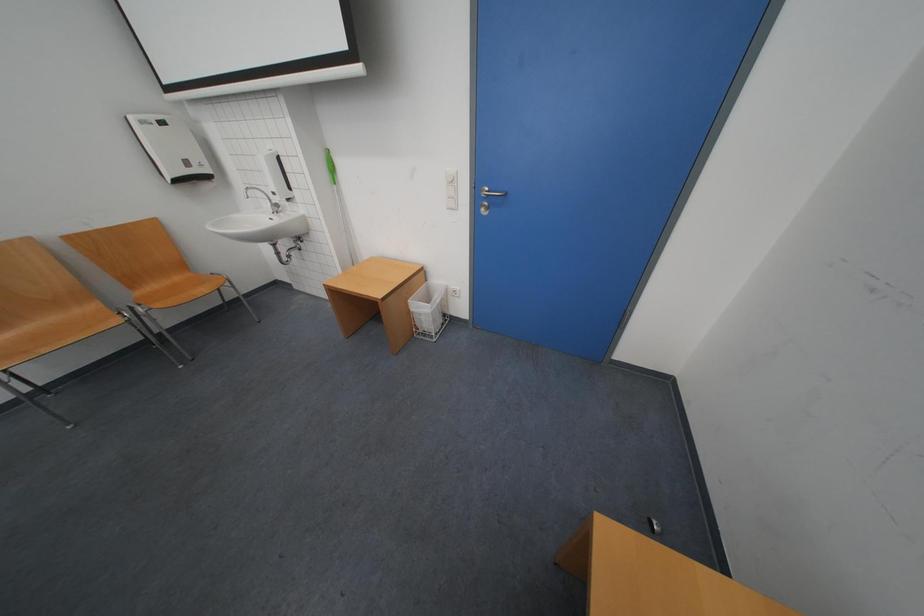
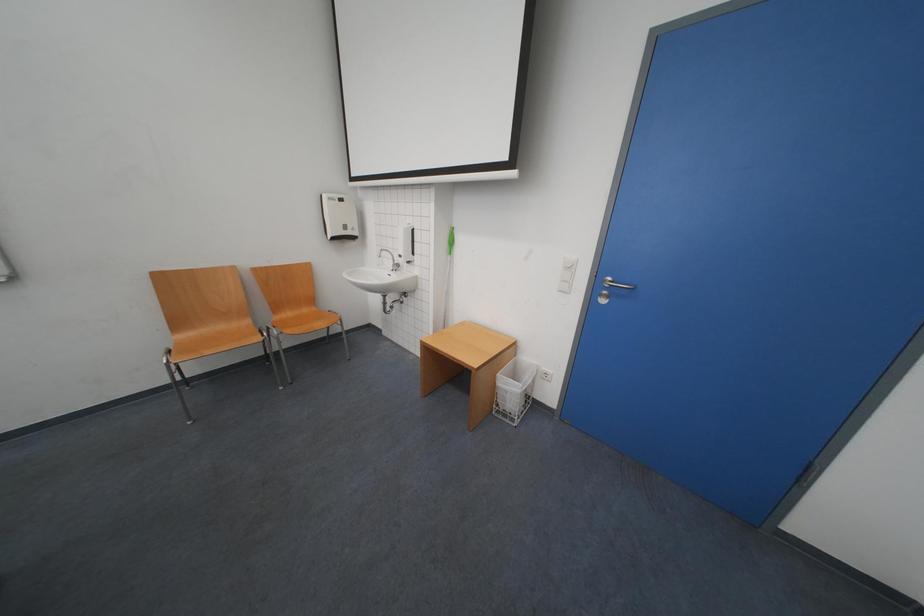
Question: How did the camera likely rotate?

Choices:
 (A) Left
 (B) Right
 (C) Up
 (D) Down

Answer: (A)